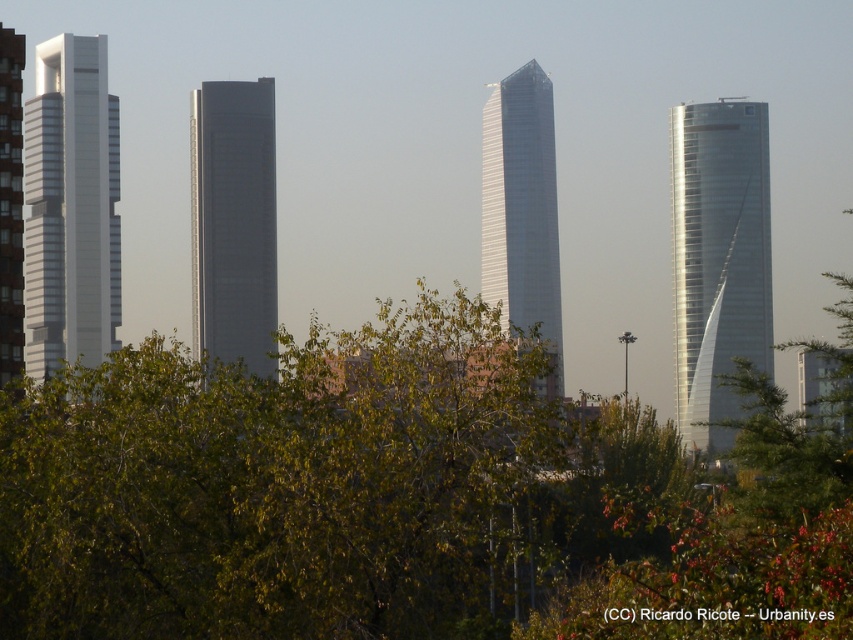
You are a city planner evaluating the space between the green leafy tree at center and the sleek metallic tower at right. Considering their sizes, which one would require more horizontal space for maintenance equipment to maneuver around?

The green leafy tree at center is bigger than the sleek metallic tower at right, so it would require more horizontal space for maintenance equipment to maneuver around.

You are an urban planner analyzing the city layout. You notice two skyscrapers in the central area labeled as smooth glass skyscraper at center and shiny glass skyscraper at center. Which one is located to the left when viewed from the front?

The smooth glass skyscraper at center is positioned on the left side of the shiny glass skyscraper at center, so it is located to the left when viewed from the front.

You are standing at the point marked by the coordinates point (399, 499) in the cityscape. Looking around, you see the tallest spiral building on the right and the sharp angular building to its left. Which direction should you walk to reach the green leafy tree at center?

The point (399, 499) corresponds to the green leafy tree at center, so you are already at the green leafy tree at center.